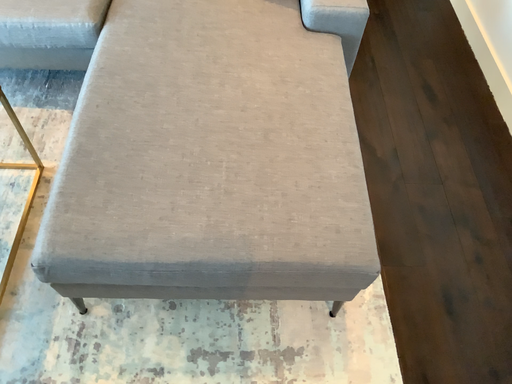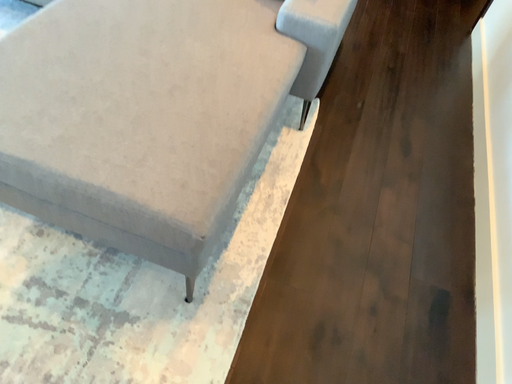
Question: How did the camera likely rotate when shooting the video?

Choices:
 (A) rotated upward
 (B) rotated downward

Answer: (A)